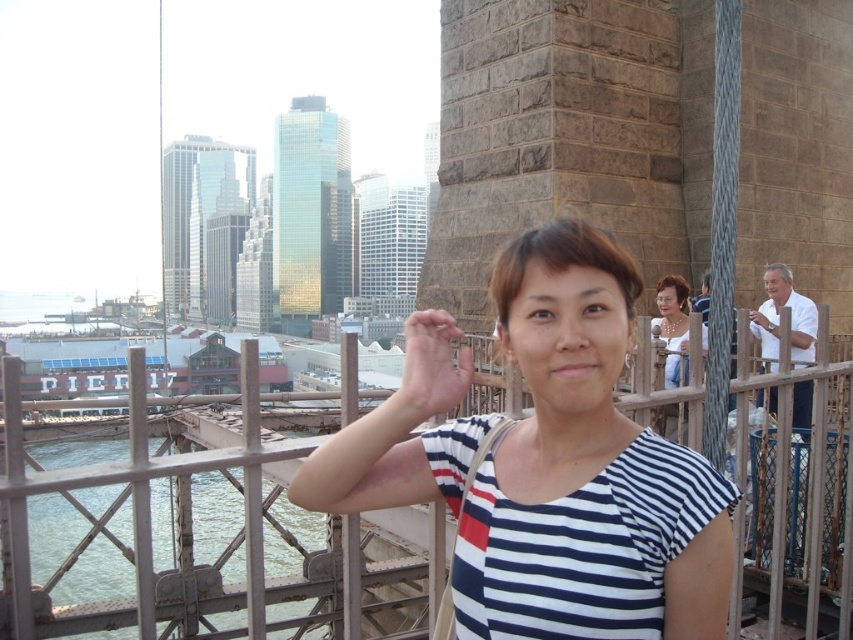
Does point (669, 467) come closer to viewer compared to point (793, 404)?

Yes, point (669, 467) is closer to viewer.

Which is below, metal fence at center or white cotton shirt at right?

metal fence at center is lower down.

At what (x,y) coordinates should I click in order to perform the action: click on metal fence at center. Please return your answer as a coordinate pair (x, y). This screenshot has height=640, width=853. Looking at the image, I should click on (181, 541).

Locate an element on the screen. metal fence at center is located at coordinates (181, 541).

Does white cotton shirt at right appear under matte gold necklace at upper right?

Incorrect, white cotton shirt at right is not positioned below matte gold necklace at upper right.

Is point (799, 385) less distant than point (688, 321)?

Yes.

Where is `white cotton shirt at right`? Image resolution: width=853 pixels, height=640 pixels. white cotton shirt at right is located at coordinates (778, 317).

Does matte skin hand at center have a greater height compared to white cotton shirt at right?

Yes.

What do you see at coordinates (430, 369) in the screenshot? I see `matte skin hand at center` at bounding box center [430, 369].

I want to click on matte skin hand at center, so click(430, 369).